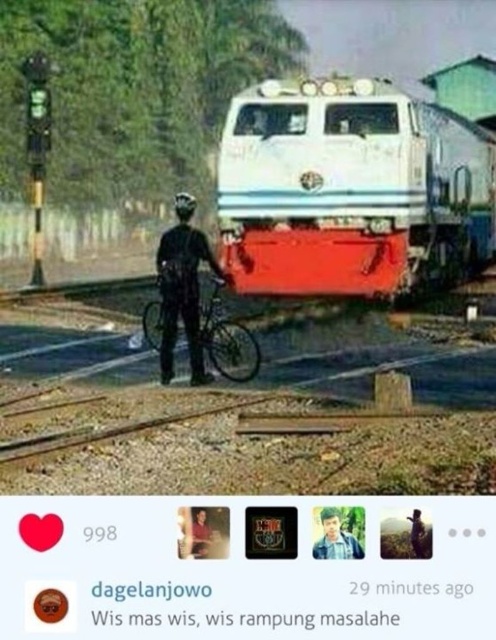
Between white glossy train at center and blue shirt at center, which one appears on the left side from the viewer's perspective?

blue shirt at center is more to the left.

Can you confirm if white glossy train at center is positioned to the right of blue shirt at center?

Correct, you'll find white glossy train at center to the right of blue shirt at center.

Where is `white glossy train at center`? white glossy train at center is located at coordinates (351, 189).

Is point (176, 195) more distant than point (325, 531)?

Yes, it is behind point (325, 531).

Between black matte bicycle at center and blue shirt at center, which one appears on the left side from the viewer's perspective?

From the viewer's perspective, black matte bicycle at center appears more on the left side.

This screenshot has height=640, width=496. In order to click on black matte bicycle at center in this screenshot , I will do `click(183, 289)`.

Identify the location of black matte bicycle at center. (183, 289).

Is point (449, 125) behind point (191, 317)?

Yes.

Does white glossy train at center appear over black matte bicycle at center?

Correct, white glossy train at center is located above black matte bicycle at center.

Which is in front, point (385, 148) or point (174, 248)?

Point (174, 248) is in front.

Identify the location of white glossy train at center. Image resolution: width=496 pixels, height=640 pixels. (351, 189).